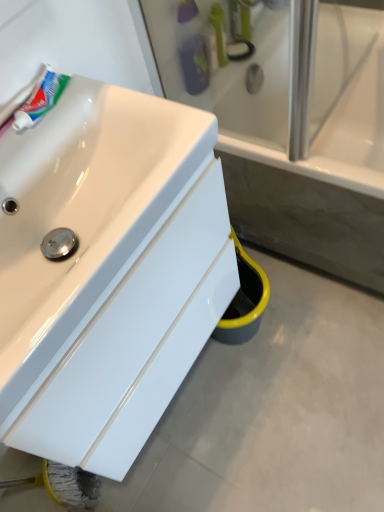
Question: Could you tell me if white ceramic bathtub at center is facing white glossy tube at upper left?

Choices:
 (A) yes
 (B) no

Answer: (B)

Question: Does white ceramic bathtub at center have a larger size compared to white glossy tube at upper left?

Choices:
 (A) yes
 (B) no

Answer: (A)

Question: Is white ceramic bathtub at center positioned with its back to white glossy tube at upper left?

Choices:
 (A) yes
 (B) no

Answer: (B)

Question: Is white ceramic bathtub at center with white glossy tube at upper left?

Choices:
 (A) no
 (B) yes

Answer: (A)

Question: From a real-world perspective, is white ceramic bathtub at center over white glossy tube at upper left?

Choices:
 (A) no
 (B) yes

Answer: (A)

Question: Is green plastic toothbrush at upper center, the 2th toiletry from the bottom, in front of or behind white glossy tube at upper left in the image?

Choices:
 (A) front
 (B) behind

Answer: (B)

Question: Does point (235, 24) appear closer or farther from the camera than point (34, 96)?

Choices:
 (A) closer
 (B) farther

Answer: (B)

Question: From the image's perspective, is green plastic toothbrush at upper center, placed as the 1th toiletry when sorted from top to bottom, positioned above or below white glossy tube at upper left?

Choices:
 (A) above
 (B) below

Answer: (A)

Question: Considering the relative positions of green plastic toothbrush at upper center, placed as the 1th toiletry when sorted from top to bottom, and white glossy tube at upper left in the image provided, is green plastic toothbrush at upper center, placed as the 1th toiletry when sorted from top to bottom, to the left or to the right of white glossy tube at upper left?

Choices:
 (A) left
 (B) right

Answer: (B)

Question: In terms of size, does green plastic toothbrush at upper center appear bigger or smaller than white ceramic bathtub at center?

Choices:
 (A) small
 (B) big

Answer: (A)

Question: Is point (215, 11) closer or farther from the camera than point (354, 20)?

Choices:
 (A) farther
 (B) closer

Answer: (B)

Question: In terms of width, does green plastic toothbrush at upper center look wider or thinner when compared to white ceramic bathtub at center?

Choices:
 (A) thin
 (B) wide

Answer: (A)

Question: Is green plastic toothbrush at upper center inside the boundaries of white ceramic bathtub at center, or outside?

Choices:
 (A) inside
 (B) outside

Answer: (B)

Question: Would you say green plastic toothbrush at upper center is inside or outside white glossy tube at upper left?

Choices:
 (A) outside
 (B) inside

Answer: (A)

Question: From the image's perspective, is green plastic toothbrush at upper center above or below white glossy tube at upper left?

Choices:
 (A) above
 (B) below

Answer: (A)